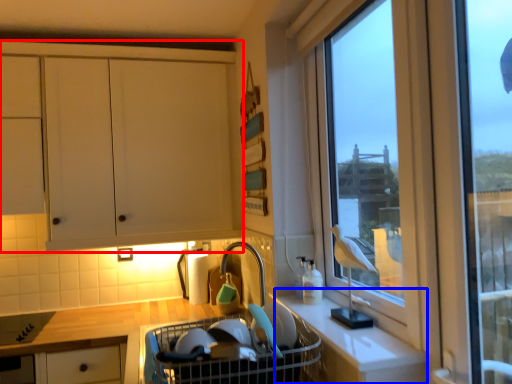
Question: Which point is further to the camera, cabinetry (highlighted by a red box) or counter (highlighted by a blue box)?

Choices:
 (A) cabinetry
 (B) counter

Answer: (A)